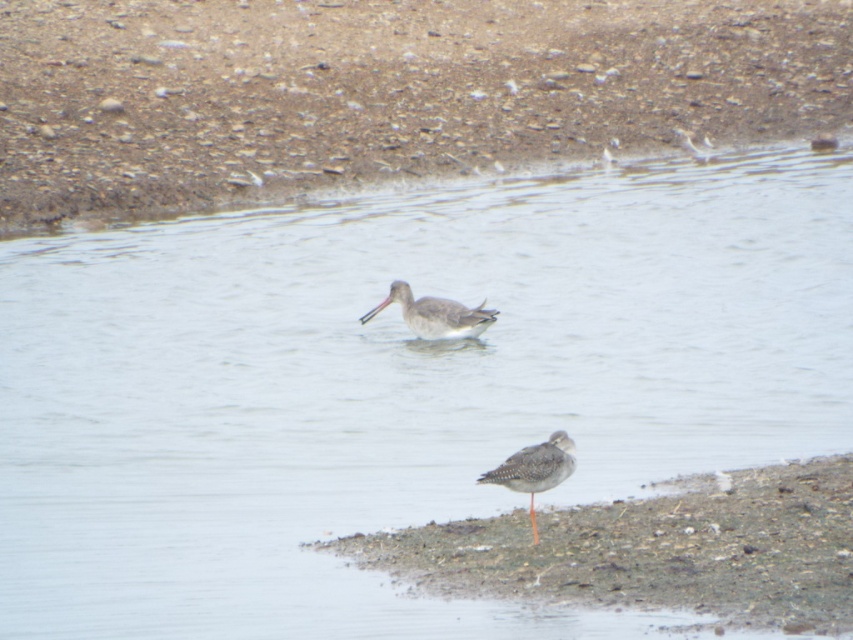
You are a photographer trying to capture both the brown sandy mud at lower right and the speckled gray bird at lower right in a single frame. Based on their sizes, which one will occupy more of the frame?

The brown sandy mud at lower right is larger in size than the speckled gray bird at lower right, so it will occupy more of the frame.